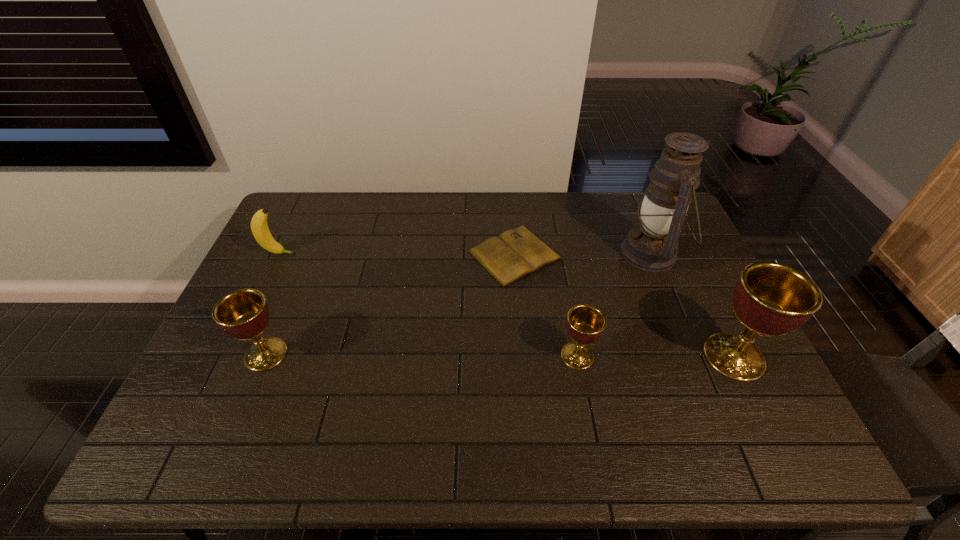
This screenshot has width=960, height=540. What are the coordinates of `free space between the rightmost chalice and the leftmost chalice` in the screenshot? It's located at (500, 355).

At what (x,y) coordinates should I click in order to perform the action: click on vacant area that lies between the shortest chalice and the leftmost chalice. Please return your answer as a coordinate pair (x, y). The image size is (960, 540). Looking at the image, I should click on (421, 355).

Locate an element on the screen. vacant region between the second tallest object and the book is located at coordinates (624, 306).

The image size is (960, 540). In order to click on vacant space that's between the tallest chalice and the banana in this screenshot , I will do `click(507, 305)`.

Locate an element on the screen. unoccupied area between the leftmost chalice and the book is located at coordinates (391, 305).

Locate an element on the screen. The image size is (960, 540). free spot between the book and the rightmost chalice is located at coordinates (624, 306).

This screenshot has width=960, height=540. Find the location of `free space that is in between the tallest chalice and the leftmost chalice`. free space that is in between the tallest chalice and the leftmost chalice is located at coordinates (500, 355).

Image resolution: width=960 pixels, height=540 pixels. What are the coordinates of `free space between the leftmost chalice and the shortest object` in the screenshot? It's located at point(391,305).

I want to click on object that is the third nearest to the rightmost chalice, so click(x=515, y=253).

Locate an element on the screen. the third closest object to the shortest object is located at coordinates (770, 299).